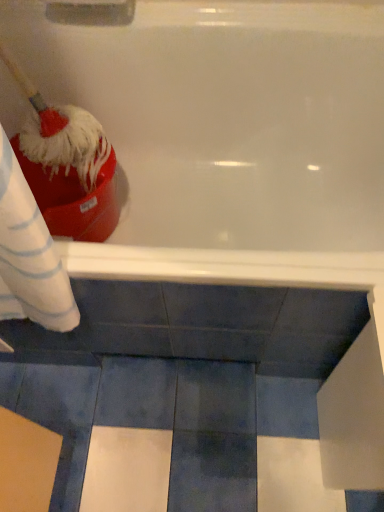
The width and height of the screenshot is (384, 512). In order to click on red fluffy brush at left in this screenshot , I will do `click(60, 134)`.

Describe the element at coordinates (60, 134) in the screenshot. This screenshot has height=512, width=384. I see `red fluffy brush at left` at that location.

Measure the distance between point (338, 87) and camera.

1.06 meters.

In order to face white glossy bathtub at upper center, should I rotate leftwards or rightwards?

You should look left and rotate roughly 1.673 degrees.

Locate an element on the screen. The height and width of the screenshot is (512, 384). white glossy bathtub at upper center is located at coordinates (229, 137).

Describe the element at coordinates (229, 137) in the screenshot. I see `white glossy bathtub at upper center` at that location.

At what (x,y) coordinates should I click in order to perform the action: click on red fluffy brush at left. Please return your answer as a coordinate pair (x, y). Image resolution: width=384 pixels, height=512 pixels. Looking at the image, I should click on click(60, 134).

In the image, is white glossy bathtub at upper center on the left side or the right side of red fluffy brush at left?

Based on their positions, white glossy bathtub at upper center is located to the right of red fluffy brush at left.

In the image, is white glossy bathtub at upper center positioned in front of or behind red fluffy brush at left?

Clearly, white glossy bathtub at upper center is behind red fluffy brush at left.

Does point (161, 60) appear closer or farther from the camera than point (54, 119)?

Point (161, 60).

From the image's perspective, is white glossy bathtub at upper center under red fluffy brush at left?

Yes.

From a real-world perspective, who is located lower, white glossy bathtub at upper center or red fluffy brush at left?

In real-world perspective, white glossy bathtub at upper center is lower.

Between white glossy bathtub at upper center and red fluffy brush at left, which one has smaller width?

red fluffy brush at left is thinner.

Considering the relative sizes of white glossy bathtub at upper center and red fluffy brush at left in the image provided, is white glossy bathtub at upper center taller than red fluffy brush at left?

Indeed, white glossy bathtub at upper center has a greater height compared to red fluffy brush at left.

Which of these two, white glossy bathtub at upper center or red fluffy brush at left, is smaller?

Smaller between the two is red fluffy brush at left.

Can we say white glossy bathtub at upper center lies outside red fluffy brush at left?

Yes.

Is white glossy bathtub at upper center in contact with red fluffy brush at left?

white glossy bathtub at upper center and red fluffy brush at left are not in contact.

Is white glossy bathtub at upper center turned away from red fluffy brush at left?

No, white glossy bathtub at upper center's orientation is not away from red fluffy brush at left.

You are a GUI agent. You are given a task and a screenshot of the screen. Output one action in this format:
    pyautogui.click(x=<x>, y=<y>)
    Task: Click on the bathtub below the red fluffy brush at left (from the image's perspective)
    The height and width of the screenshot is (512, 384).
    Given the screenshot: What is the action you would take?
    pyautogui.click(x=229, y=137)

Is red fluffy brush at left to the right of white glossy bathtub at upper center from the viewer's perspective?

In fact, red fluffy brush at left is to the left of white glossy bathtub at upper center.

Relative to white glossy bathtub at upper center, is red fluffy brush at left in front or behind?

Visually, red fluffy brush at left is located in front of white glossy bathtub at upper center.

Considering the positions of points (15, 64) and (311, 106), is point (15, 64) farther from camera compared to point (311, 106)?

No, (15, 64) is closer to viewer.

From the image's perspective, is red fluffy brush at left on top of white glossy bathtub at upper center?

Yes, from the image's perspective, red fluffy brush at left is on top of white glossy bathtub at upper center.

From a real-world perspective, which is physically above, red fluffy brush at left or white glossy bathtub at upper center?

red fluffy brush at left is physically above.

Which of these two, red fluffy brush at left or white glossy bathtub at upper center, is wider?

white glossy bathtub at upper center.

Is red fluffy brush at left shorter than white glossy bathtub at upper center?

Yes, red fluffy brush at left is shorter than white glossy bathtub at upper center.

Considering the relative sizes of red fluffy brush at left and white glossy bathtub at upper center in the image provided, is red fluffy brush at left bigger than white glossy bathtub at upper center?

Incorrect, red fluffy brush at left is not larger than white glossy bathtub at upper center.

Which is correct: red fluffy brush at left is inside white glossy bathtub at upper center, or outside of it?

red fluffy brush at left is located inside white glossy bathtub at upper center.

Is red fluffy brush at left directly adjacent to white glossy bathtub at upper center?

red fluffy brush at left is not next to white glossy bathtub at upper center, and they're not touching.

Is red fluffy brush at left facing away from white glossy bathtub at upper center?

Yes.

How many degrees apart are the facing directions of red fluffy brush at left and white glossy bathtub at upper center?

red fluffy brush at left and white glossy bathtub at upper center are facing 0.000292 degrees away from each other.

You are a GUI agent. You are given a task and a screenshot of the screen. Output one action in this format:
    pyautogui.click(x=<x>, y=<y>)
    Task: Click on the brush above the white glossy bathtub at upper center (from the image's perspective)
    This screenshot has height=512, width=384.
    Given the screenshot: What is the action you would take?
    point(60,134)

The image size is (384, 512). In order to click on bathtub behind the red fluffy brush at left in this screenshot , I will do `click(229, 137)`.

You are a GUI agent. You are given a task and a screenshot of the screen. Output one action in this format:
    pyautogui.click(x=<x>, y=<y>)
    Task: Click on the brush to the left of white glossy bathtub at upper center
    
    Given the screenshot: What is the action you would take?
    pyautogui.click(x=60, y=134)